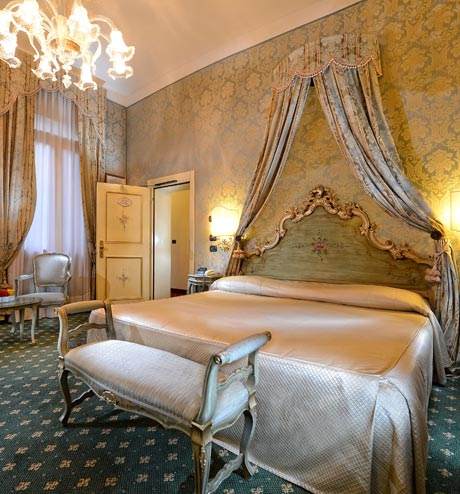
Identify the location of 2 types of curtains. The width and height of the screenshot is (460, 494). (44, 218), (22, 205).